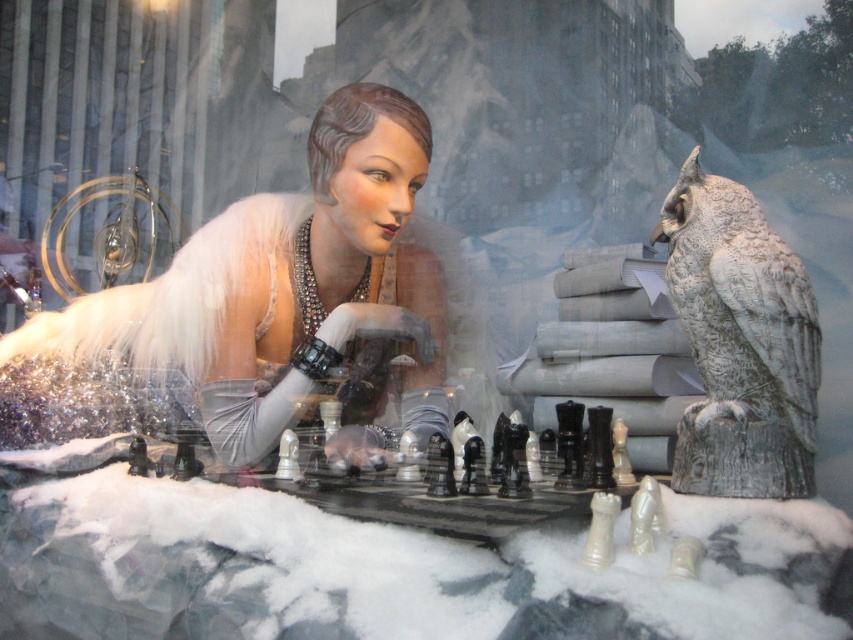
Does shiny silver dress at center have a larger size compared to gray stone owl at upper right?

Yes.

In order to click on shiny silver dress at center in this screenshot , I will do pos(265,310).

Identify the location of shiny silver dress at center. Image resolution: width=853 pixels, height=640 pixels. (265, 310).